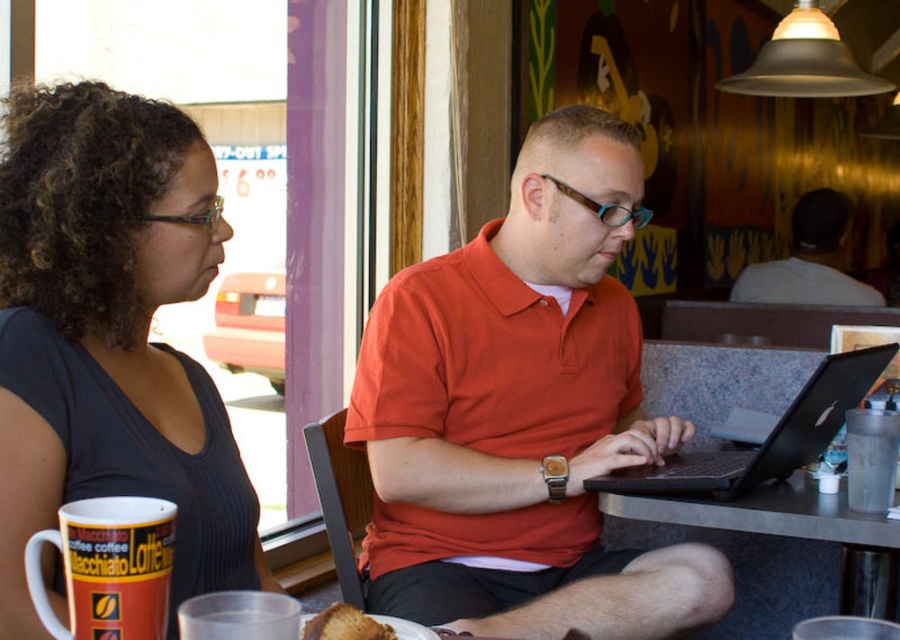
Question: Can you confirm if orange matte shirt at center is positioned to the left of dark gray ribbed shirt at left?

Choices:
 (A) no
 (B) yes

Answer: (A)

Question: Estimate the real-world distances between objects in this image. Which object is farther from the black matte laptop at center?

Choices:
 (A) white matte shirt at upper right
 (B) dark gray ribbed shirt at left
 (C) orange matte shirt at center

Answer: (A)

Question: Does black matte laptop at center appear on the right side of golden brown crumbly pastry at lower center?

Choices:
 (A) yes
 (B) no

Answer: (A)

Question: Is orange matte shirt at center smaller than golden brown crumbly pastry at lower center?

Choices:
 (A) yes
 (B) no

Answer: (B)

Question: Which is nearer to the black matte laptop at center?

Choices:
 (A) golden brown crumbly pastry at lower center
 (B) black granite table at center

Answer: (B)

Question: Which point is farther to the camera?

Choices:
 (A) black matte laptop at center
 (B) black granite table at center

Answer: (A)